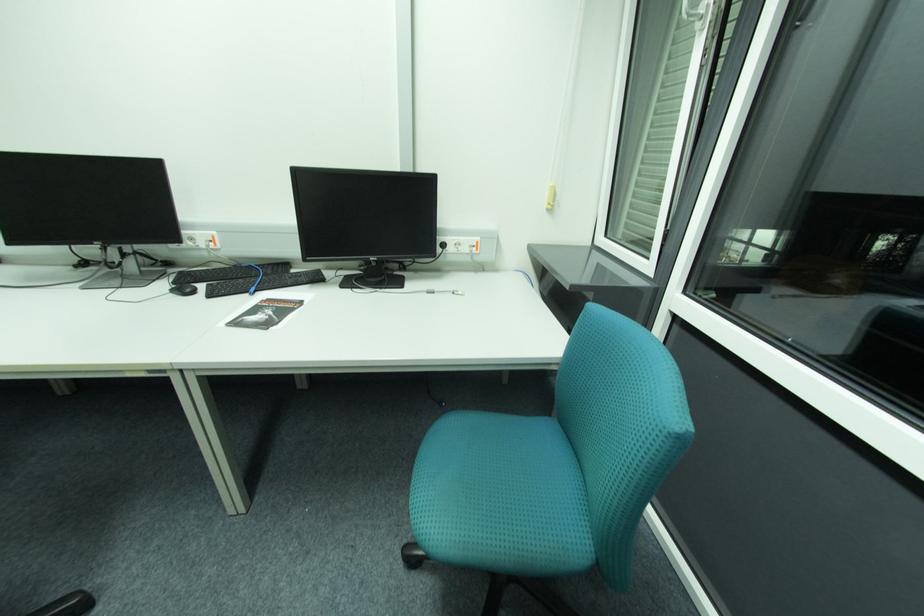
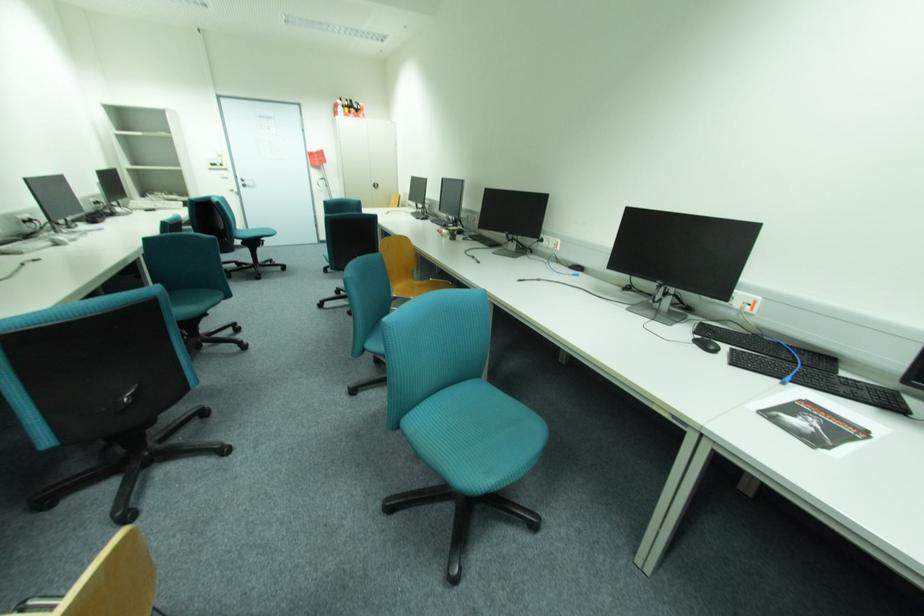
Find the pixel in the second image that matches (195,291) in the first image.

(716, 347)